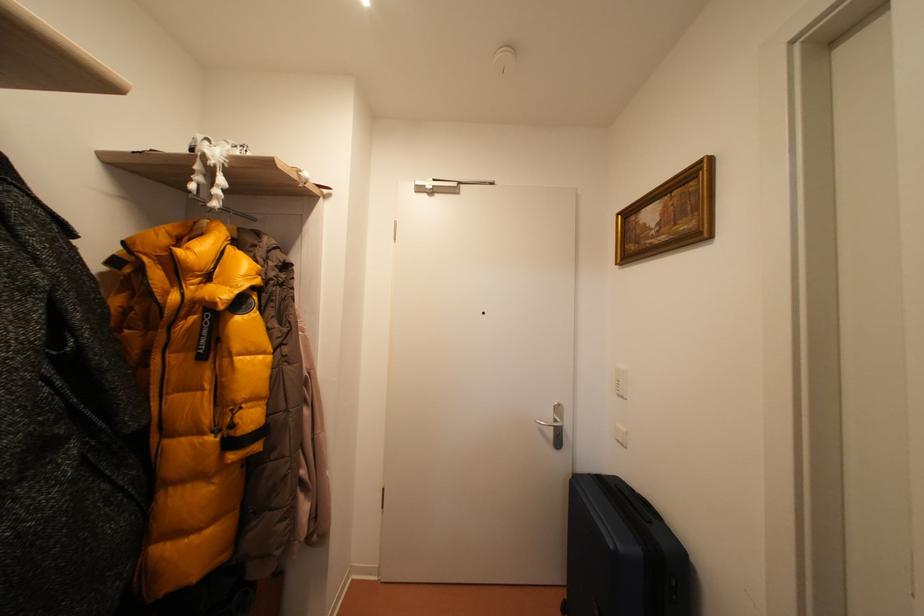
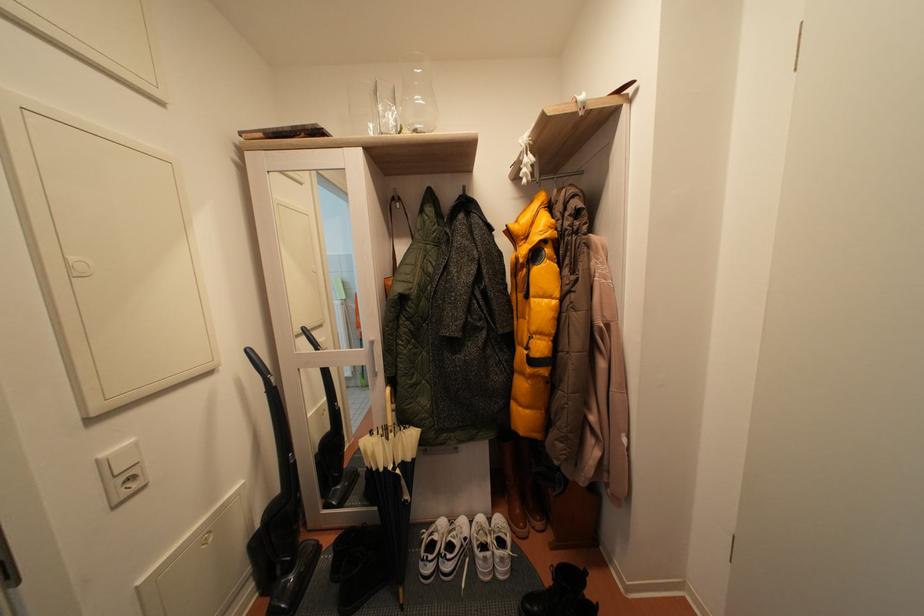
Question: The camera is either moving clockwise (left) or counter-clockwise (right) around the object. The first image is from the beginning of the video and the second image is from the end. Is the camera moving left or right when shooting the video?

Choices:
 (A) Left
 (B) Right

Answer: (B)